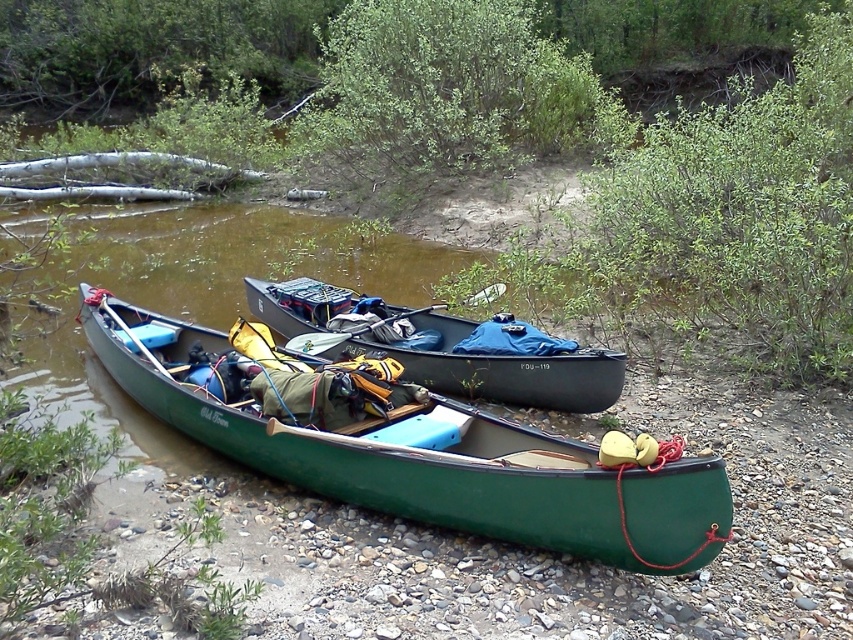
Question: Based on their relative distances, which object is farther from the white plastic paddle at center?

Choices:
 (A) green matte canoe at lower left
 (B) wooden paddle at center

Answer: (B)

Question: Is matte black canoe at center below white plastic paddle at center?

Choices:
 (A) yes
 (B) no

Answer: (A)

Question: Among these points, which one is nearest to the camera?

Choices:
 (A) (457, 360)
 (B) (527, 442)
 (C) (137, 348)

Answer: (B)

Question: Is green matte canoe at lower left above matte black canoe at center?

Choices:
 (A) no
 (B) yes

Answer: (A)

Question: Is green matte canoe at lower left below wooden paddle at center?

Choices:
 (A) no
 (B) yes

Answer: (B)

Question: Estimate the real-world distances between objects in this image. Which object is closer to the white plastic paddle at center?

Choices:
 (A) green matte canoe at lower left
 (B) matte black canoe at center
 (C) wooden paddle at center

Answer: (B)